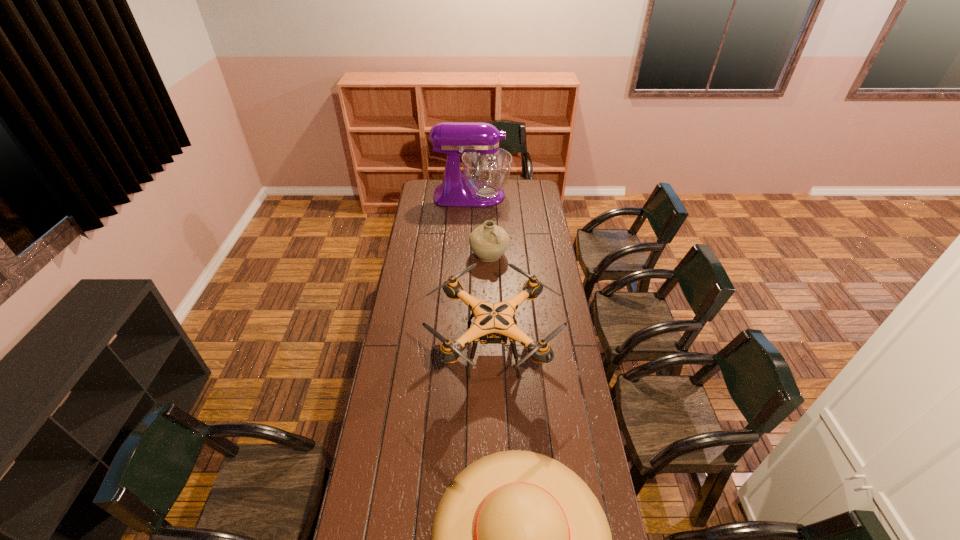
Where is `object present at the left edge`? object present at the left edge is located at coordinates (486, 168).

This screenshot has width=960, height=540. I want to click on object present at the right edge, so click(493, 324).

Where is `object located at the far left corner`? Image resolution: width=960 pixels, height=540 pixels. object located at the far left corner is located at coordinates (486, 168).

This screenshot has width=960, height=540. In the image, there is a desktop. Identify the location of vacant space at the left edge. (410, 383).

At what (x,y) coordinates should I click in order to perform the action: click on vacant space at the right edge. Please return your answer as a coordinate pair (x, y). Looking at the image, I should click on (523, 220).

Where is `vacant space at the far left corner`? The image size is (960, 540). vacant space at the far left corner is located at coordinates (423, 188).

Where is `free location at the far right corner`? Image resolution: width=960 pixels, height=540 pixels. free location at the far right corner is located at coordinates (526, 191).

The image size is (960, 540). In order to click on vacant area that lies between the third tallest object and the second tallest object in this screenshot , I will do `click(491, 301)`.

Identify the location of unoccupied position between the second nearest object and the farthest object. This screenshot has width=960, height=540. (483, 272).

Where is `vacant region between the drone and the third tallest object`? vacant region between the drone and the third tallest object is located at coordinates (491, 301).